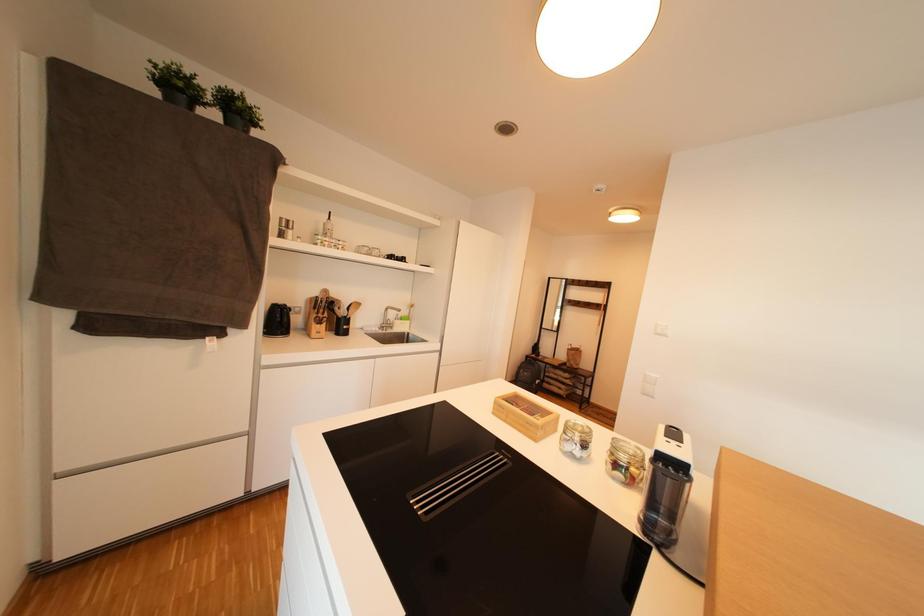
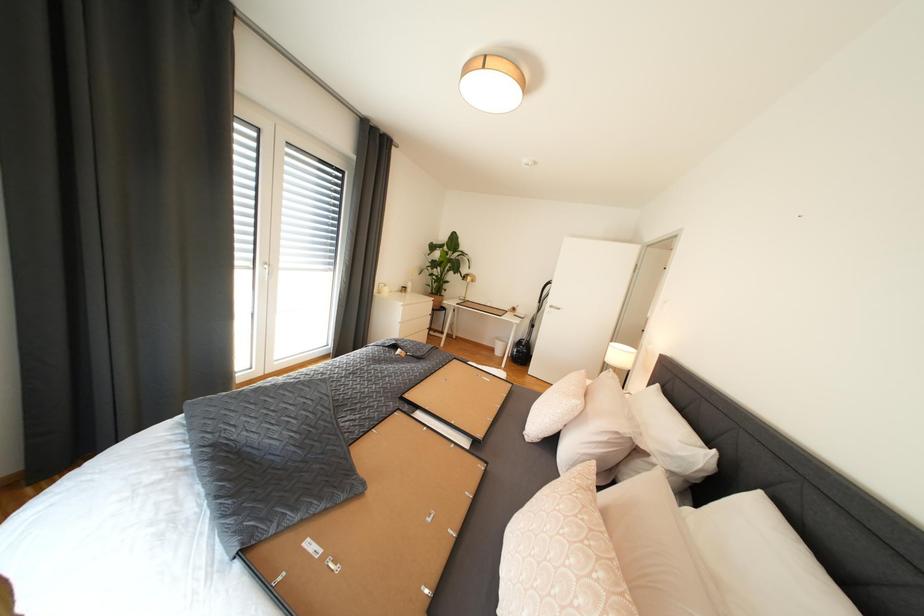
The images are taken continuously from a first-person perspective. In which direction are you moving?

The cameraman walked toward left, forward.